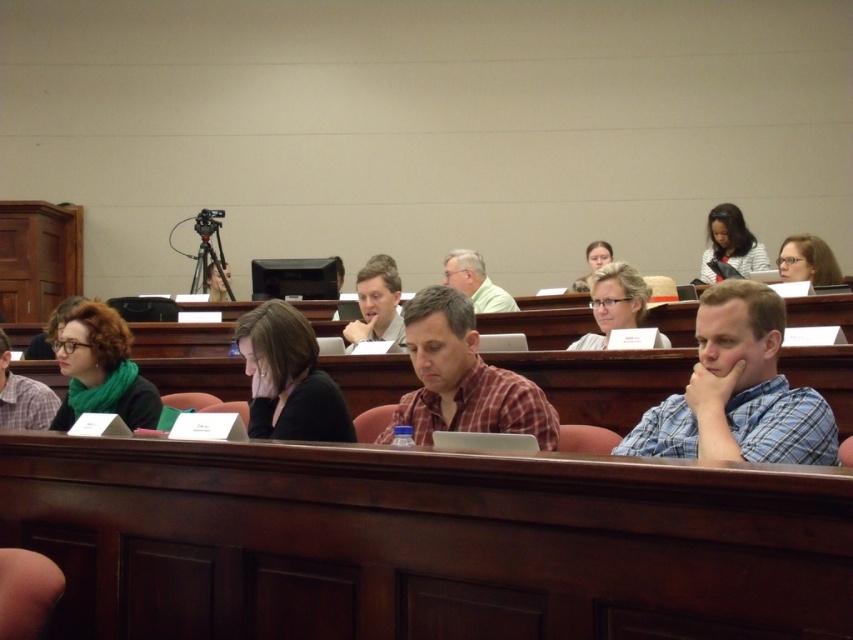
Question: Which point is farther to the camera?

Choices:
 (A) blue plaid shirt at center
 (B) matte black glasses at upper right
 (C) matte black hair at upper center

Answer: (C)

Question: Is the position of green scarf at left less distant than that of matte black glasses at upper right?

Choices:
 (A) no
 (B) yes

Answer: (B)

Question: Which object appears farthest from the camera in this image?

Choices:
 (A) matte black glasses at left
 (B) blue plaid shirt at center

Answer: (A)

Question: Can you confirm if black fabric jacket at center is positioned to the right of matte white shirt at center?

Choices:
 (A) yes
 (B) no

Answer: (B)

Question: Is black fabric jacket at center below green scarf at left?

Choices:
 (A) no
 (B) yes

Answer: (A)

Question: Which point is farther to the camera?

Choices:
 (A) matte black camera at upper center
 (B) matte black glasses at upper right
 (C) matte black glasses at center
 (D) matte black laptop at upper right

Answer: (A)